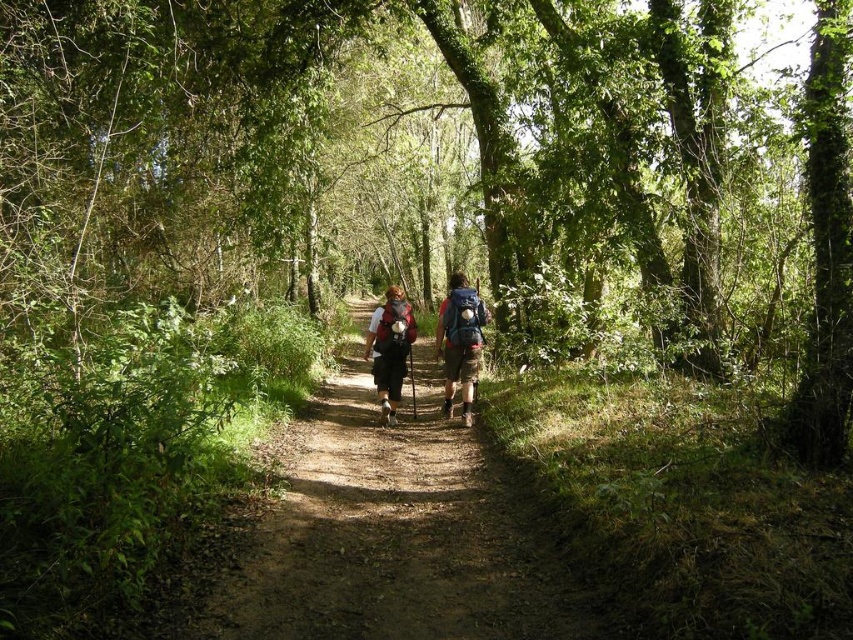
Can you confirm if matte fabric backpacks at center is thinner than matte blue backpack at center?

Incorrect, matte fabric backpacks at center's width is not less than matte blue backpack at center's.

Consider the image. Which of these two, matte fabric backpacks at center or matte blue backpack at center, stands taller?

With more height is matte fabric backpacks at center.

Locate an element on the screen. Image resolution: width=853 pixels, height=640 pixels. matte fabric backpacks at center is located at coordinates (460, 340).

At what (x,y) coordinates should I click in order to perform the action: click on matte fabric backpacks at center. Please return your answer as a coordinate pair (x, y). The height and width of the screenshot is (640, 853). Looking at the image, I should click on (460, 340).

Is dirt path at center shorter than matte black backpack at center?

Yes, dirt path at center is shorter than matte black backpack at center.

Who is positioned more to the right, dirt path at center or matte black backpack at center?

dirt path at center

You are a GUI agent. You are given a task and a screenshot of the screen. Output one action in this format:
    pyautogui.click(x=<x>, y=<y>)
    Task: Click on the dirt path at center
    This screenshot has width=853, height=640.
    Given the screenshot: What is the action you would take?
    pyautogui.click(x=392, y=536)

Which is more to the left, dirt path at center or matte blue backpack at center?

Positioned to the left is dirt path at center.

Which of these two, dirt path at center or matte blue backpack at center, stands shorter?

Standing shorter between the two is matte blue backpack at center.

Which is behind, point (299, 470) or point (451, 406)?

The point (451, 406) is behind.

Image resolution: width=853 pixels, height=640 pixels. I want to click on dirt path at center, so click(392, 536).